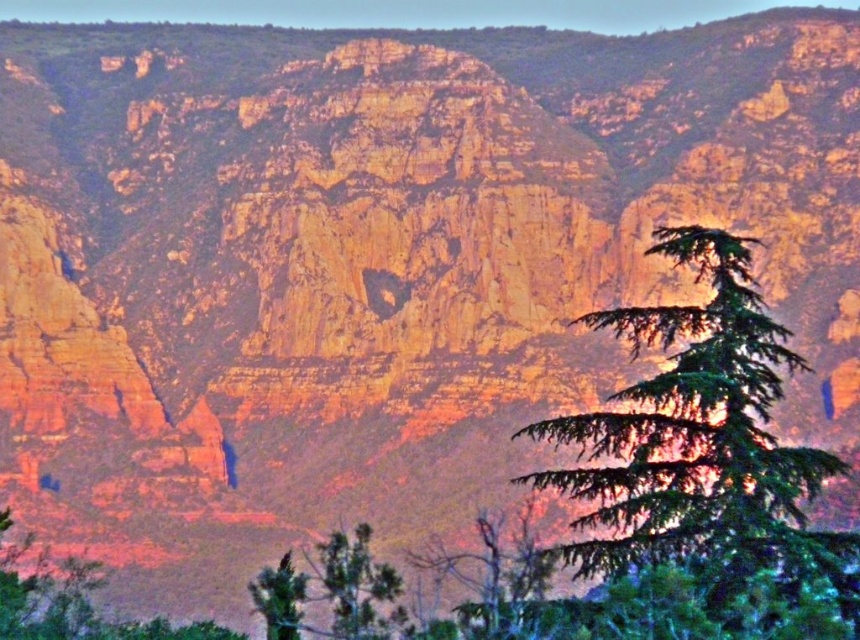
You are standing in the dramatic landscape with rugged rock formations. You see two points marked in the image. Which point is closer to you, point (688, 250) or point (298, 595)?

Point (688, 250) is closer to the viewer than point (298, 595).